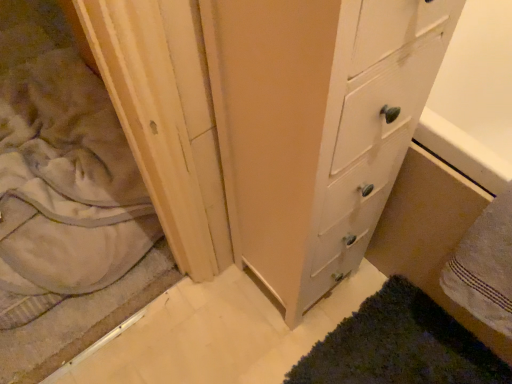
What do you see at coordinates (399, 345) in the screenshot? This screenshot has width=512, height=384. I see `dark green shaggy bath mat at lower right` at bounding box center [399, 345].

Identify the location of beige soft fabric at left. This screenshot has width=512, height=384. (67, 182).

Looking at the image, does dark green shaggy bath mat at lower right seem bigger or smaller compared to beige soft fabric at left?

Clearly, dark green shaggy bath mat at lower right is smaller in size than beige soft fabric at left.

Is point (437, 313) less distant than point (72, 108)?

Yes, it is.

From the picture: Which of these two, dark green shaggy bath mat at lower right or beige soft fabric at left, stands shorter?

dark green shaggy bath mat at lower right.

Looking at this image, looking at their sizes, would you say dark green shaggy bath mat at lower right is wider or thinner than beige soft fabric at left?

Considering their sizes, dark green shaggy bath mat at lower right looks slimmer than beige soft fabric at left.

From the image's perspective, is beige soft fabric at left under dark green shaggy bath mat at lower right?

No, from the image's perspective, beige soft fabric at left is not below dark green shaggy bath mat at lower right.

Is beige soft fabric at left in contact with dark green shaggy bath mat at lower right?

beige soft fabric at left and dark green shaggy bath mat at lower right are not in contact.

This screenshot has height=384, width=512. What are the coordinates of `sheet that appears above the dark green shaggy bath mat at lower right (from a real-world perspective)` in the screenshot? It's located at (67, 182).

From a real-world perspective, is dark green shaggy bath mat at lower right located higher than white textured towel at lower right?

Incorrect, from a real-world perspective, dark green shaggy bath mat at lower right is lower than white textured towel at lower right.

From the picture: Between dark green shaggy bath mat at lower right and white textured towel at lower right, which one has less height?

With less height is dark green shaggy bath mat at lower right.

Between dark green shaggy bath mat at lower right and white textured towel at lower right, which one appears on the left side from the viewer's perspective?

From the viewer's perspective, dark green shaggy bath mat at lower right appears more on the left side.

Between dark green shaggy bath mat at lower right and white textured towel at lower right, which one has smaller width?

A: Thinner between the two is white textured towel at lower right.

You are a GUI agent. You are given a task and a screenshot of the screen. Output one action in this format:
    pyautogui.click(x=<x>, y=<y>)
    Task: Click on the sheet that appears behind the white textured towel at lower right
    This screenshot has height=384, width=512.
    Given the screenshot: What is the action you would take?
    pyautogui.click(x=67, y=182)

Is white textured towel at lower right not inside beige soft fabric at left?

Indeed, white textured towel at lower right is completely outside beige soft fabric at left.

From the image's perspective, between white textured towel at lower right and beige soft fabric at left, which one is located above?

beige soft fabric at left.

How much distance is there between white textured towel at lower right and beige soft fabric at left?

white textured towel at lower right is 1.01 meters from beige soft fabric at left.

Considering the relative sizes of white textured towel at lower right and white wood chest of drawers at center in the image provided, is white textured towel at lower right shorter than white wood chest of drawers at center?

Correct, white textured towel at lower right is not as tall as white wood chest of drawers at center.

From a real-world perspective, is white textured towel at lower right below white wood chest of drawers at center?

Correct, in the physical world, white textured towel at lower right is lower than white wood chest of drawers at center.

Which of these two, white textured towel at lower right or white wood chest of drawers at center, is wider?

white wood chest of drawers at center is wider.

In terms of width, does white wood chest of drawers at center look wider or thinner when compared to white textured towel at lower right?

white wood chest of drawers at center is wider than white textured towel at lower right.

From a real-world perspective, which is physically above, white wood chest of drawers at center or white textured towel at lower right?

In real-world perspective, white wood chest of drawers at center is above.

Looking at the image, does white wood chest of drawers at center seem bigger or smaller compared to white textured towel at lower right?

Clearly, white wood chest of drawers at center is larger in size than white textured towel at lower right.

Is white wood chest of drawers at center wider or thinner than beige soft fabric at left?

In the image, white wood chest of drawers at center appears to be more narrow than beige soft fabric at left.

Is white wood chest of drawers at center at the right side of beige soft fabric at left?

Yes, white wood chest of drawers at center is to the right of beige soft fabric at left.

Would you say white wood chest of drawers at center is inside or outside beige soft fabric at left?

white wood chest of drawers at center is located beyond the bounds of beige soft fabric at left.

From a real-world perspective, between white wood chest of drawers at center and beige soft fabric at left, who is vertically higher?

white wood chest of drawers at center, from a real-world perspective.

Locate an element on the screen. sheet on the left of the dark green shaggy bath mat at lower right is located at coordinates (67, 182).

Identify the location of sheet located above the dark green shaggy bath mat at lower right (from the image's perspective). (67, 182).

Which object lies nearer to the anchor point white textured towel at lower right, dark green shaggy bath mat at lower right or white wood chest of drawers at center?

dark green shaggy bath mat at lower right lies closer to white textured towel at lower right than the other object.

Considering their positions, is white textured towel at lower right positioned closer to beige soft fabric at left than dark green shaggy bath mat at lower right?

Among the two, dark green shaggy bath mat at lower right is located nearer to beige soft fabric at left.

When comparing their distances from white wood chest of drawers at center, does white textured towel at lower right or beige soft fabric at left seem further?

Among the two, beige soft fabric at left is located further to white wood chest of drawers at center.

Estimate the real-world distances between objects in this image. Which object is further from white wood chest of drawers at center, dark green shaggy bath mat at lower right or beige soft fabric at left?

beige soft fabric at left lies further to white wood chest of drawers at center than the other object.

When comparing their distances from dark green shaggy bath mat at lower right, does white textured towel at lower right or white wood chest of drawers at center seem closer?

Among the two, white textured towel at lower right is located nearer to dark green shaggy bath mat at lower right.

Looking at the image, which one is located further to white textured towel at lower right, beige soft fabric at left or white wood chest of drawers at center?

Among the two, beige soft fabric at left is located further to white textured towel at lower right.

Considering their positions, is white wood chest of drawers at center positioned further to white textured towel at lower right than dark green shaggy bath mat at lower right?

Among the two, white wood chest of drawers at center is located further to white textured towel at lower right.

Looking at this image, looking at the image, which one is located further to beige soft fabric at left, white wood chest of drawers at center or white textured towel at lower right?

white textured towel at lower right lies further to beige soft fabric at left than the other object.

The width and height of the screenshot is (512, 384). Identify the location of chest of drawers between beige soft fabric at left and dark green shaggy bath mat at lower right in the horizontal direction. (316, 126).

I want to click on bath mat between beige soft fabric at left and white textured towel at lower right from left to right, so pos(399,345).

Identify the location of chest of drawers between beige soft fabric at left and white textured towel at lower right from left to right. (316, 126).

Where is `bath towel that lies between white wood chest of drawers at center and dark green shaggy bath mat at lower right from top to bottom`? The height and width of the screenshot is (384, 512). bath towel that lies between white wood chest of drawers at center and dark green shaggy bath mat at lower right from top to bottom is located at coordinates (485, 267).